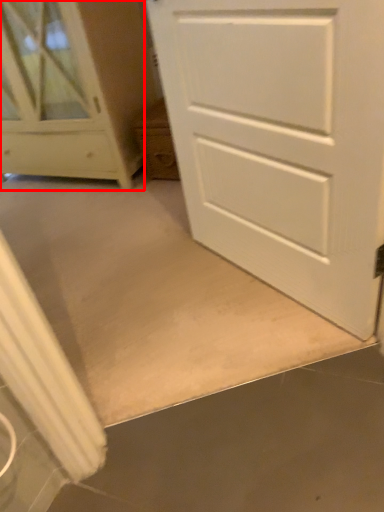
Question: From the image, what is the correct spatial relationship of chest of drawers (annotated by the red box) in relation to door?

Choices:
 (A) right
 (B) left

Answer: (B)